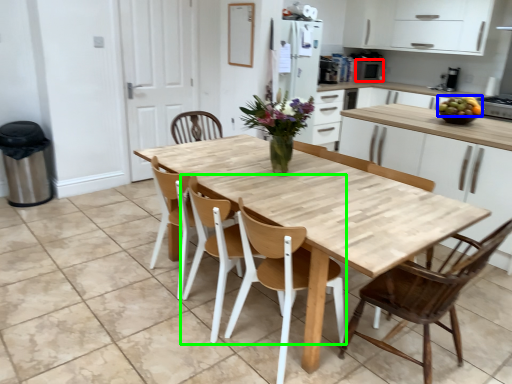
Question: Which object is the closest to the appliance (highlighted by a red box)? Choose among these: fruit (highlighted by a blue box) or chair (highlighted by a green box).

Choices:
 (A) fruit
 (B) chair

Answer: (A)